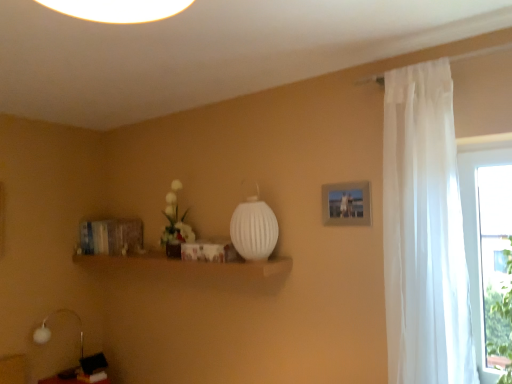
What do you see at coordinates (505, 319) in the screenshot?
I see `green leafy plant at right` at bounding box center [505, 319].

The width and height of the screenshot is (512, 384). What do you see at coordinates (346, 203) in the screenshot?
I see `matte silver picture frame at upper right` at bounding box center [346, 203].

Identify the location of green leafy plant at right. (505, 319).

This screenshot has width=512, height=384. I want to click on plant on the right of white fabric table lamp at lower left, so click(505, 319).

Is green leafy plant at right facing towards white fabric table lamp at lower left?

No, green leafy plant at right is not facing towards white fabric table lamp at lower left.

Measure the distance from green leafy plant at right to white fabric table lamp at lower left.

green leafy plant at right and white fabric table lamp at lower left are 2.93 meters apart from each other.

Are green leafy plant at right and white fabric table lamp at lower left far apart?

Yes, green leafy plant at right and white fabric table lamp at lower left are quite far apart.

Where is `plant lying below the white sheer curtain at right (from the image's perspective)`? plant lying below the white sheer curtain at right (from the image's perspective) is located at coordinates (505, 319).

How distant is white sheer curtain at right from green leafy plant at right?

white sheer curtain at right and green leafy plant at right are 19.32 inches apart.

From a real-world perspective, which is physically above, white sheer curtain at right or green leafy plant at right?

From a 3D spatial view, white sheer curtain at right is above.

Who is taller, white sheer curtain at right or green leafy plant at right?

With more height is white sheer curtain at right.

From a real-world perspective, is matte silver picture frame at upper right above or below white ribbed glass vase at center?

matte silver picture frame at upper right is situated higher than white ribbed glass vase at center in the real world.

Is matte silver picture frame at upper right facing towards white ribbed glass vase at center?

No, matte silver picture frame at upper right is not oriented towards white ribbed glass vase at center.

Is point (358, 223) farther from camera compared to point (265, 216)?

No.

In terms of width, does matte silver picture frame at upper right look wider or thinner when compared to white ribbed glass vase at center?

Considering their sizes, matte silver picture frame at upper right looks slimmer than white ribbed glass vase at center.

Which of these two, matte silver picture frame at upper right or white fabric table lamp at lower left, stands shorter?

Standing shorter between the two is matte silver picture frame at upper right.

Is matte silver picture frame at upper right looking in the opposite direction of white fabric table lamp at lower left?

No, white fabric table lamp at lower left is not at the back of matte silver picture frame at upper right.

Is matte silver picture frame at upper right surrounding white fabric table lamp at lower left?

No, white fabric table lamp at lower left is not a part of matte silver picture frame at upper right.

Does matte silver picture frame at upper right have a smaller size compared to white fabric table lamp at lower left?

Indeed, matte silver picture frame at upper right has a smaller size compared to white fabric table lamp at lower left.

From the image's perspective, which is above, white ribbed glass vase at center or green leafy plant at right?

white ribbed glass vase at center appears higher in the image.

How much distance is there between white ribbed glass vase at center and green leafy plant at right?

white ribbed glass vase at center is 1.16 meters away from green leafy plant at right.

Does white ribbed glass vase at center have a smaller size compared to green leafy plant at right?

Correct, white ribbed glass vase at center occupies less space than green leafy plant at right.

Considering the sizes of white ribbed glass vase at center and white fabric table lamp at lower left in the image, is white ribbed glass vase at center wider or thinner than white fabric table lamp at lower left?

Considering their sizes, white ribbed glass vase at center looks broader than white fabric table lamp at lower left.

From a real-world perspective, which is physically below, white ribbed glass vase at center or white fabric table lamp at lower left?

white fabric table lamp at lower left is physically lower.

Which is correct: white ribbed glass vase at center is inside white fabric table lamp at lower left, or outside of it?

white ribbed glass vase at center is not inside white fabric table lamp at lower left, it's outside.

Consider the image. From a real-world perspective, is white sheer curtain at right above or below white ribbed glass vase at center?

white sheer curtain at right is below white ribbed glass vase at center.

Between white sheer curtain at right and white ribbed glass vase at center, which one is positioned in front?

white sheer curtain at right is more forward.

Is white sheer curtain at right not close to white ribbed glass vase at center?

That's not correct — white sheer curtain at right is a little close to white ribbed glass vase at center.

Which object is positioned more to the right, white sheer curtain at right or white ribbed glass vase at center?

Positioned to the right is white sheer curtain at right.

Identify the location of table lamp that appears behind the green leafy plant at right. (51, 331).

Identify the location of curtain located above the green leafy plant at right (from the image's perspective). The height and width of the screenshot is (384, 512). (424, 232).

Which object lies further to the anchor point white ribbed glass vase at center, matte silver picture frame at upper right or white fabric table lamp at lower left?

white fabric table lamp at lower left.

When comparing their distances from matte silver picture frame at upper right, does white ribbed glass vase at center or white fabric table lamp at lower left seem further?

The object further to matte silver picture frame at upper right is white fabric table lamp at lower left.

Which object lies further to the anchor point white fabric table lamp at lower left, green leafy plant at right or matte silver picture frame at upper right?

Among the two, green leafy plant at right is located further to white fabric table lamp at lower left.

When comparing their distances from green leafy plant at right, does white ribbed glass vase at center or matte silver picture frame at upper right seem closer?

Based on the image, matte silver picture frame at upper right appears to be nearer to green leafy plant at right.

Based on their spatial positions, is white fabric table lamp at lower left or white sheer curtain at right further from matte silver picture frame at upper right?

white fabric table lamp at lower left is further to matte silver picture frame at upper right.

Which object lies nearer to the anchor point white sheer curtain at right, white ribbed glass vase at center or matte silver picture frame at upper right?

Among the two, matte silver picture frame at upper right is located nearer to white sheer curtain at right.

Estimate the real-world distances between objects in this image. Which object is further from green leafy plant at right, matte silver picture frame at upper right or white fabric table lamp at lower left?

Based on the image, white fabric table lamp at lower left appears to be further to green leafy plant at right.

Based on the photo, which object lies further to the anchor point white sheer curtain at right, matte silver picture frame at upper right or green leafy plant at right?

The object further to white sheer curtain at right is green leafy plant at right.

You are a GUI agent. You are given a task and a screenshot of the screen. Output one action in this format:
    pyautogui.click(x=<x>, y=<y>)
    Task: Click on the picture frame between white fabric table lamp at lower left and green leafy plant at right
    
    Given the screenshot: What is the action you would take?
    pyautogui.click(x=346, y=203)

Find the location of `glass vase between white fabric table lamp at lower left and green leafy plant at right in the horizontal direction`. glass vase between white fabric table lamp at lower left and green leafy plant at right in the horizontal direction is located at coordinates (254, 226).

Where is `picture frame between white fabric table lamp at lower left and white sheer curtain at right in the horizontal direction`? This screenshot has width=512, height=384. picture frame between white fabric table lamp at lower left and white sheer curtain at right in the horizontal direction is located at coordinates (346, 203).

Where is `picture frame between white ribbed glass vase at center and green leafy plant at right`? The width and height of the screenshot is (512, 384). picture frame between white ribbed glass vase at center and green leafy plant at right is located at coordinates (346, 203).